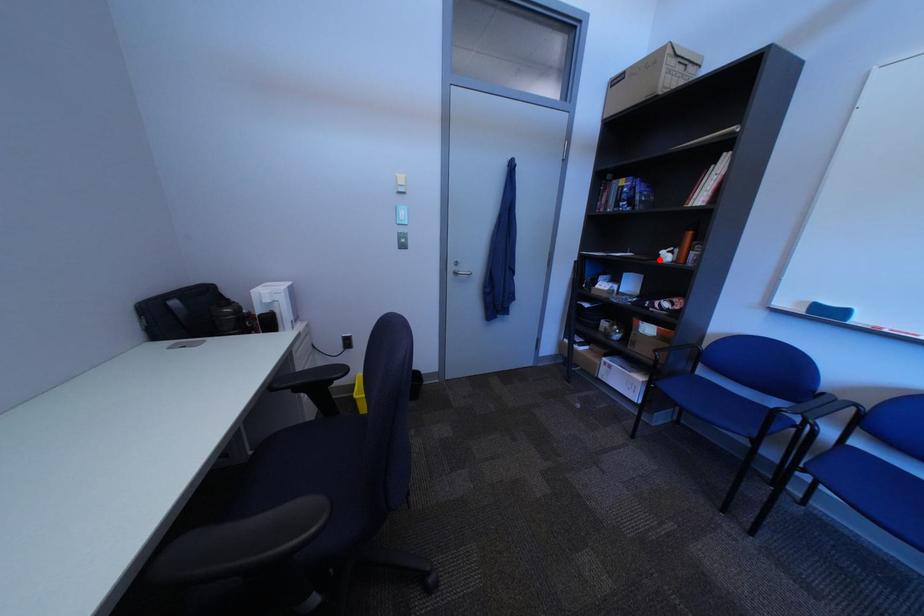
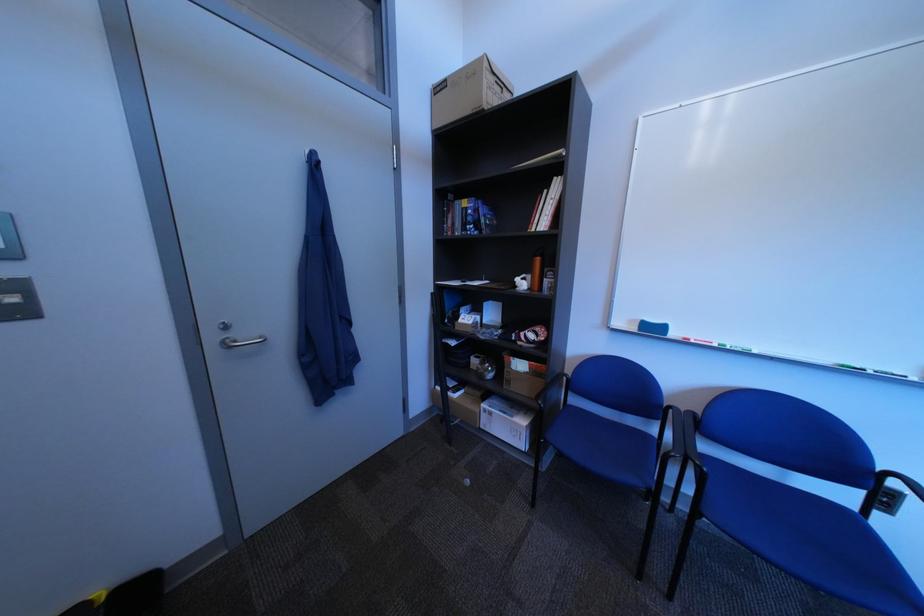
Question: I am providing you with two images of the same scene from different viewpoints. In image1, a red point is highlighted. Considering the same 3D point in image2, which of the following is correct?

Choices:
 (A) It is closer
 (B) It is farther

Answer: (B)